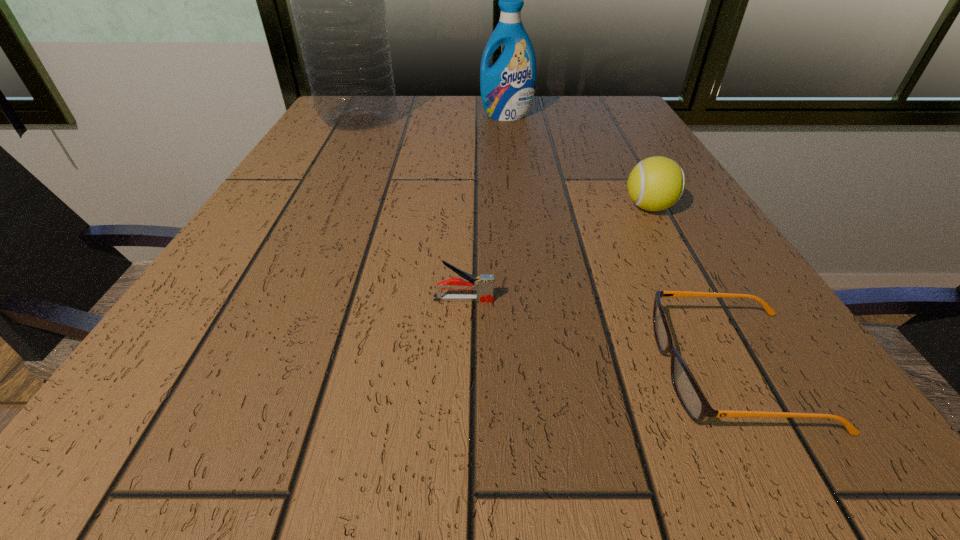
Locate an element on the screen. The width and height of the screenshot is (960, 540). vacant position in the image that satisfies the following two spatial constraints: 1. on the front-facing side of the detergent; 2. on the handle side of the stapler is located at coordinates (529, 299).

Where is `free space that satisfies the following two spatial constraints: 1. on the front-facing side of the detergent; 2. on the right side of the third farthest object`? The width and height of the screenshot is (960, 540). free space that satisfies the following two spatial constraints: 1. on the front-facing side of the detergent; 2. on the right side of the third farthest object is located at coordinates (517, 207).

Find the location of `vacant region that satisfies the following two spatial constraints: 1. on the front-facing side of the second tallest object; 2. on the left side of the third farthest object`. vacant region that satisfies the following two spatial constraints: 1. on the front-facing side of the second tallest object; 2. on the left side of the third farthest object is located at coordinates (517, 207).